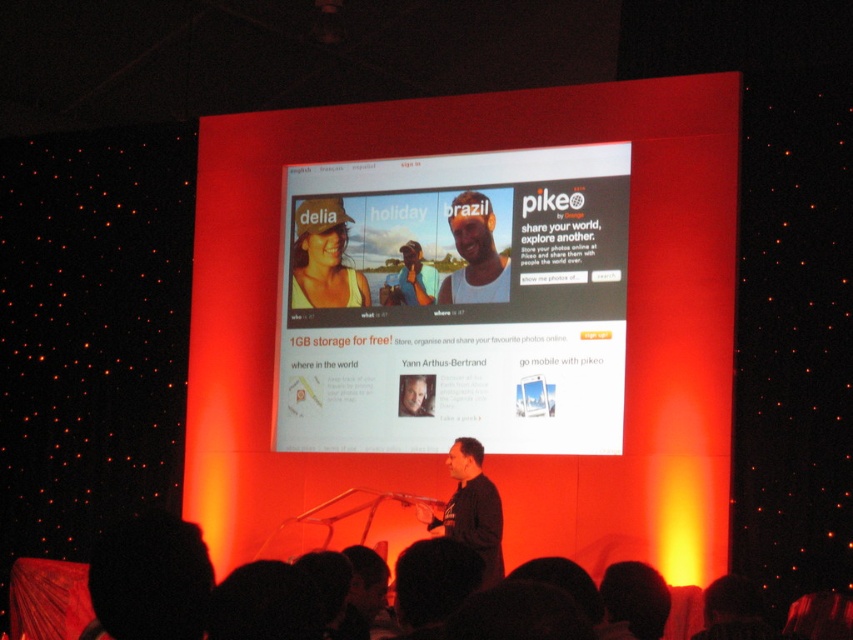
Who is positioned more to the right, matte black woman at upper left or black matte shirt at center?

From the viewer's perspective, black matte shirt at center appears more on the right side.

Who is more forward, [305,252] or [434,529]?

Point [434,529] is more forward.

I want to click on matte black woman at upper left, so click(323, 259).

Is black fabric at lower center positioned before smooth skin portrait at center?

Yes, it is.

Describe the element at coordinates (189, 588) in the screenshot. The height and width of the screenshot is (640, 853). I see `black fabric at lower center` at that location.

What do you see at coordinates (189, 588) in the screenshot?
I see `black fabric at lower center` at bounding box center [189, 588].

At what (x,y) coordinates should I click in order to perform the action: click on black fabric at lower center. Please return your answer as a coordinate pair (x, y). This screenshot has height=640, width=853. Looking at the image, I should click on (189, 588).

Which is behind, point (259, 611) or point (339, 273)?

The point (339, 273) is more distant.

The width and height of the screenshot is (853, 640). What do you see at coordinates (189, 588) in the screenshot?
I see `black fabric at lower center` at bounding box center [189, 588].

Where is `black fabric at lower center`? black fabric at lower center is located at coordinates (189, 588).